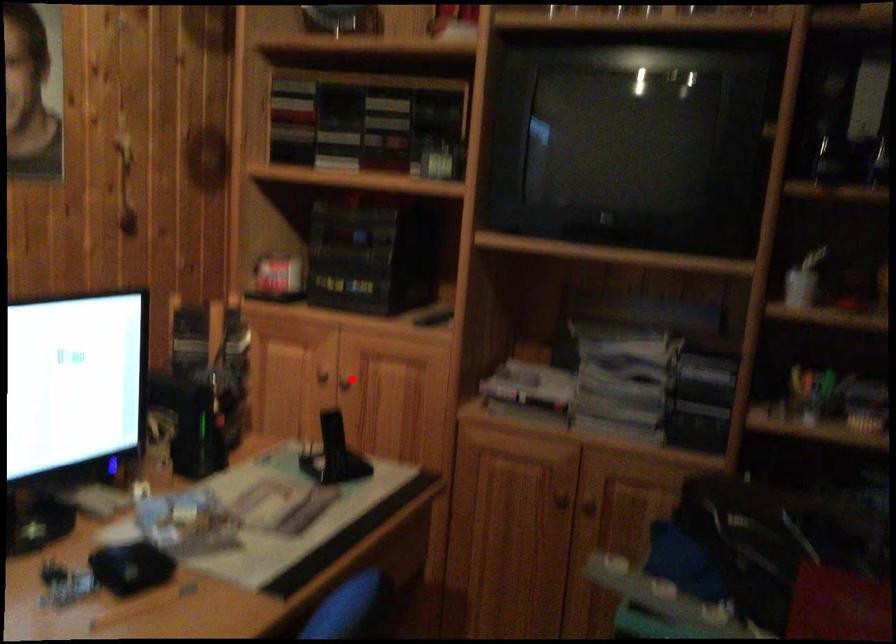
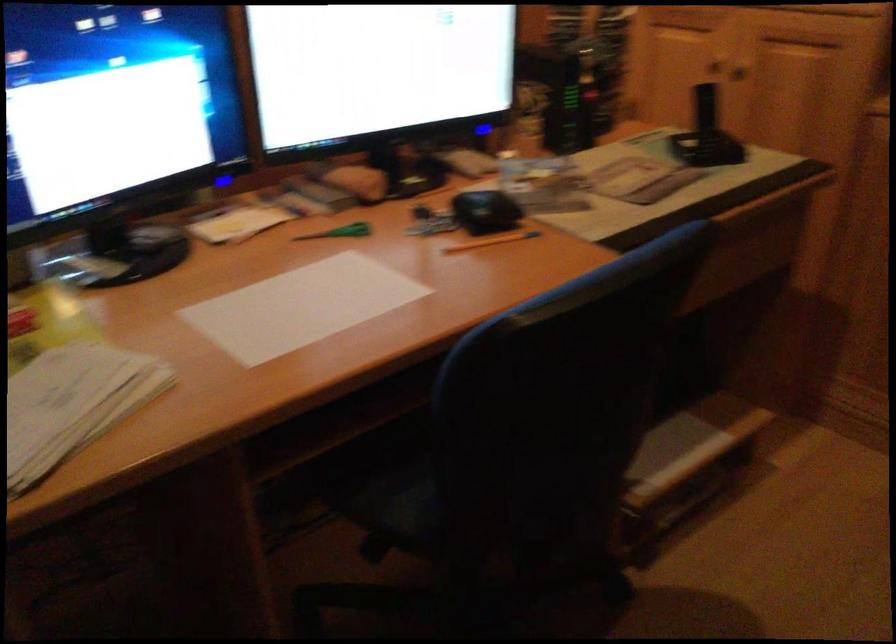
The point at the highlighted location is marked in the first image. Where is the corresponding point in the second image?

(734, 76)